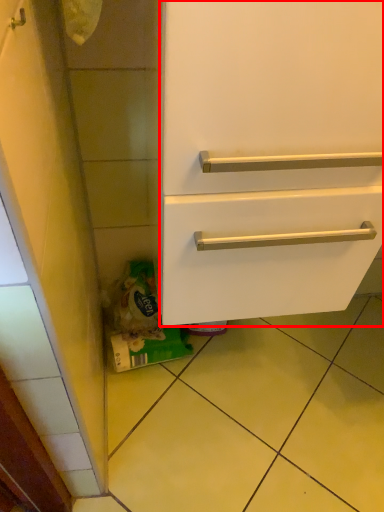
Question: Where is drawer (annotated by the red box) located in relation to tile in the image?

Choices:
 (A) left
 (B) right

Answer: (A)